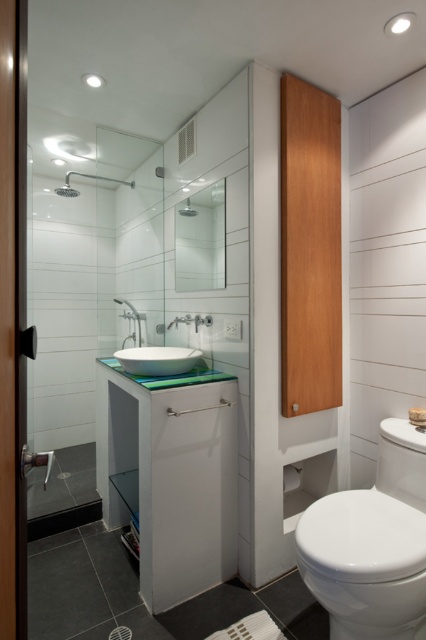
From the picture: What are the coordinates of the matte silver shower head at upper left?

The coordinates of the matte silver shower head at upper left are 0.278 in the x direction and 0.204 in the y direction.